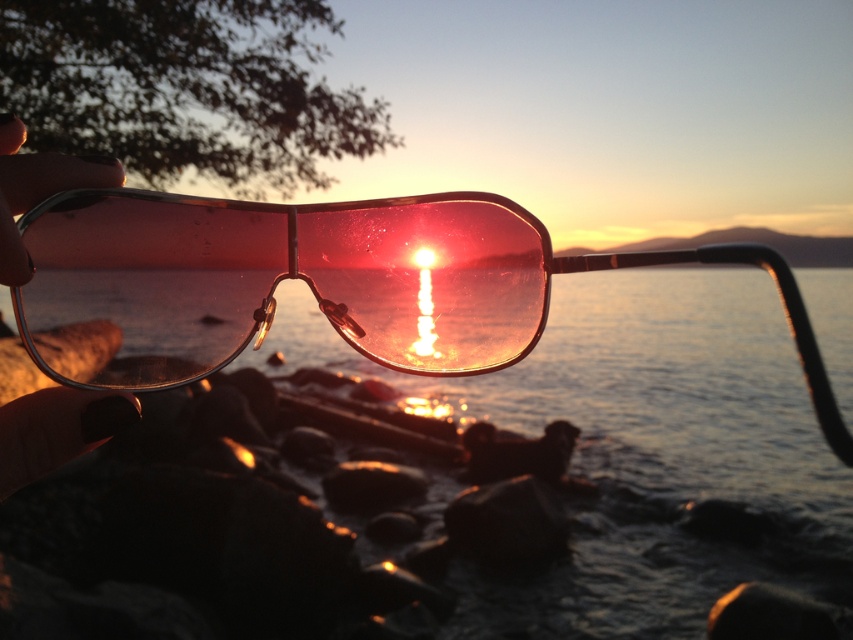
Question: Which object appears farthest from the camera in this image?

Choices:
 (A) translucent water at center
 (B) transparent plastic goggles at center

Answer: (B)

Question: Is translucent water at center behind transparent plastic goggles at center?

Choices:
 (A) yes
 (B) no

Answer: (B)

Question: Does translucent water at center appear over transparent plastic goggles at center?

Choices:
 (A) yes
 (B) no

Answer: (B)

Question: Is translucent water at center closer to the viewer compared to transparent plastic goggles at center?

Choices:
 (A) yes
 (B) no

Answer: (A)

Question: Which of the following is the farthest from the observer?

Choices:
 (A) (160, 252)
 (B) (813, 316)

Answer: (A)